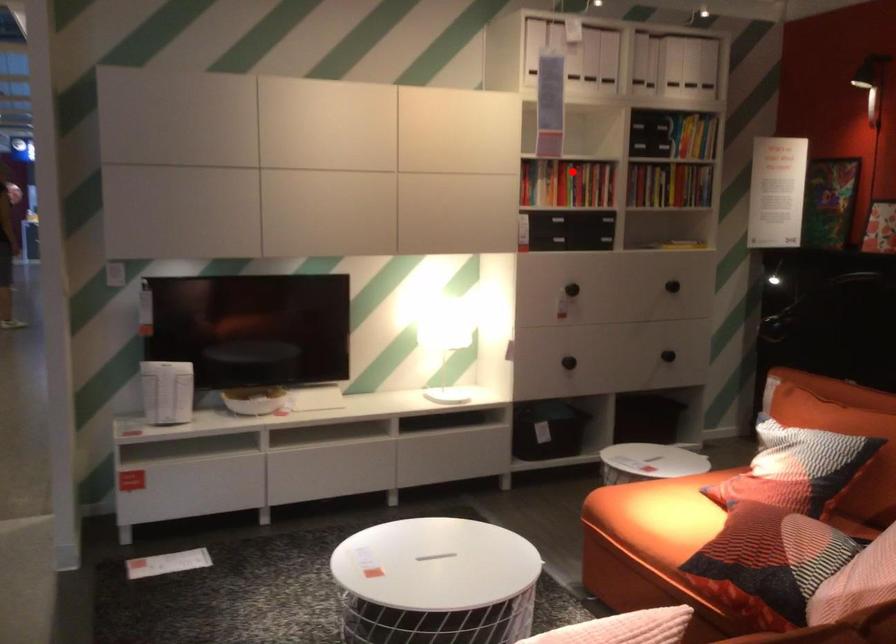
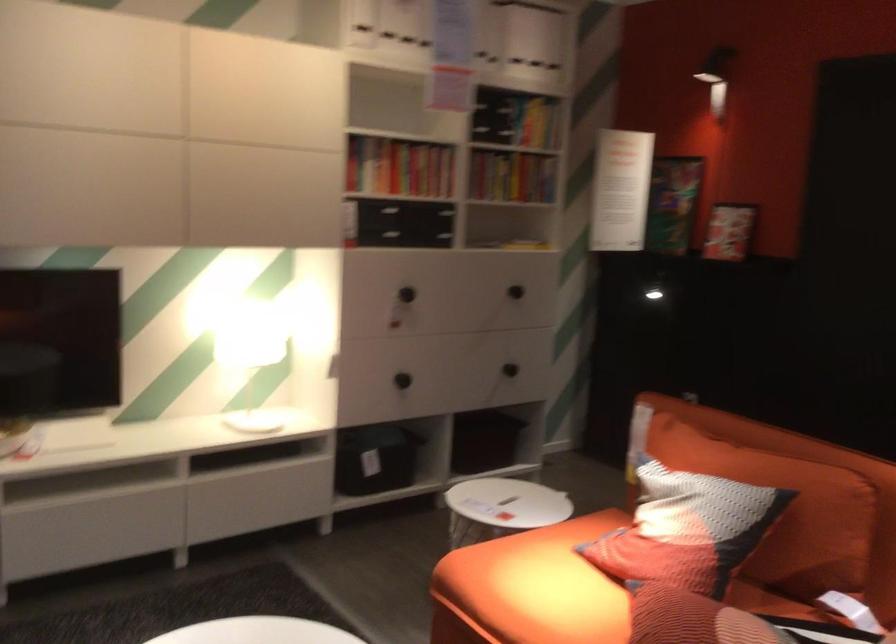
The point at the highlighted location is marked in the first image. Where is the corresponding point in the second image?

(399, 167)